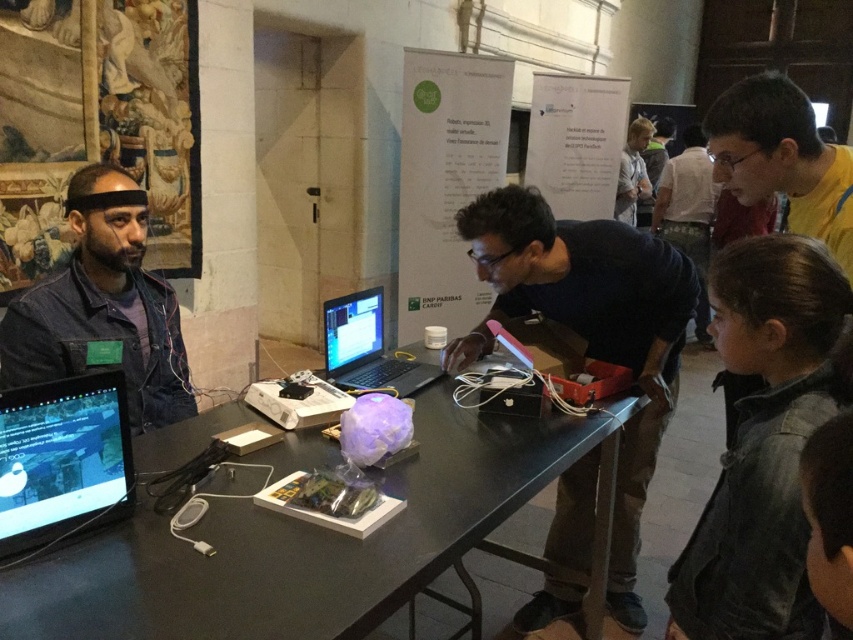
You are standing in front of the table at the tech event. Where is the denim jacket at left positioned relative to the other items on the table?

The denim jacket at left is positioned at the coordinates point (102, 307) on the table.

You are an attendee at the tech event and want to pick up both the denim jacket at left and the yellow fabric shirt at upper right. Which item will you need to reach further to get?

Result: The yellow fabric shirt at upper right requires reaching further because it is farther from the viewer compared to the denim jacket at left.

You are attending a tech event in a historical building and notice a black glossy table at center and a denim jacket at left. From your perspective, which object is positioned further to the left?

The denim jacket at left is positioned further to the left compared to the black glossy table at center.